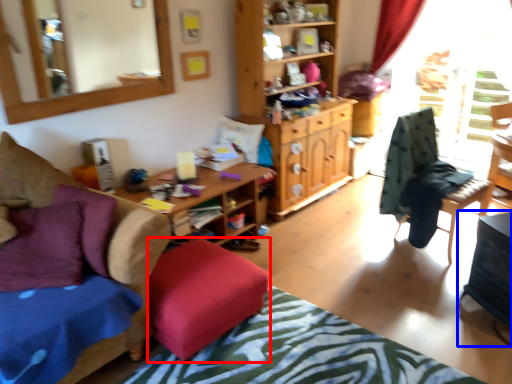
Question: Which object is further to the camera taking this photo, stool (highlighted by a red box) or table (highlighted by a blue box)?

Choices:
 (A) stool
 (B) table

Answer: (B)